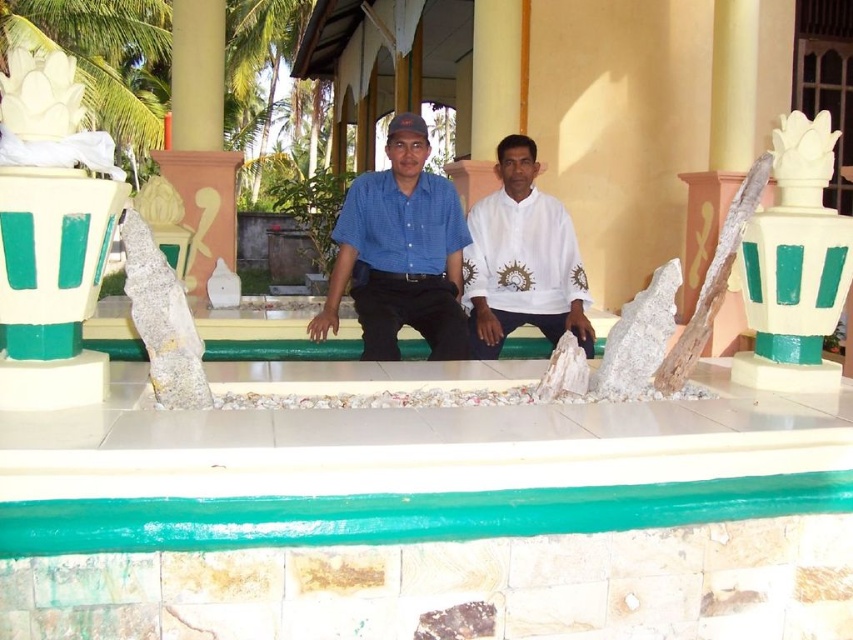
You are a tour guide leading a group to a sacred site. You need to ensure that the distance between the green painted stone ledge at center and the gray stone sculpture at center is at least 8 feet for safety. Based on the image, is the current distance sufficient?

The green painted stone ledge at center is 7.41 feet away from the gray stone sculpture at center, which is less than the required 8 feet. Therefore, the current distance is not sufficient for safety.

You are an architect designing a garden layout and need to place a new statue that requires a base wider than 20 cm. Looking at the white painted stone vase at right and the white stone pillar at right, which one can provide a suitable base for the statue?

The white stone pillar at right is thicker than the white painted stone vase at right, so the pillar can provide a suitable base for the statue since it is wider than 20 cm.

You are standing in front of the decorative structure where two people are seated. There are two points marked on the tiled surface. One is at coordinate point [795,182] and the other at point [401,349]. Which of these two points is nearer to you?

Point [795,182] is closer to the viewer than point [401,349].